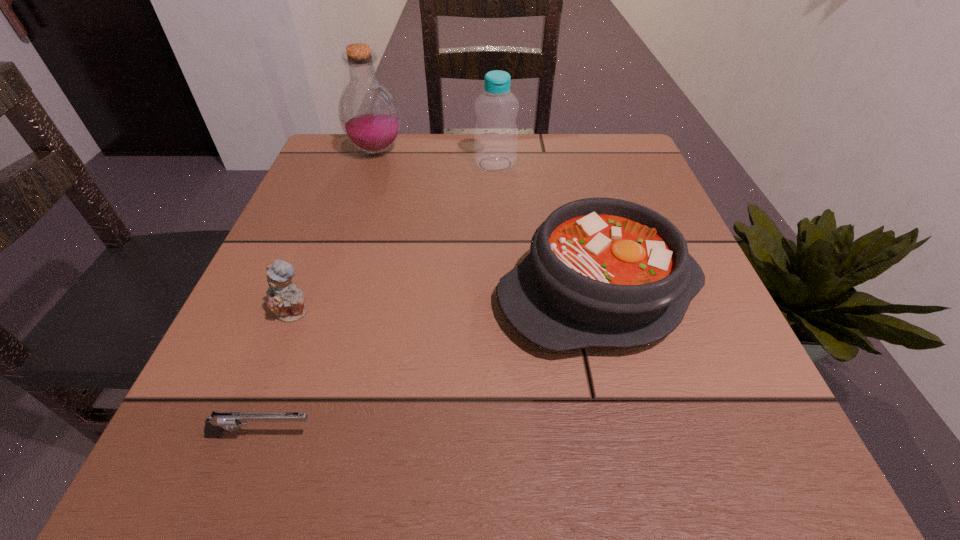
Locate an element on the screen. The height and width of the screenshot is (540, 960). free location at the left edge is located at coordinates [295, 367].

This screenshot has height=540, width=960. I want to click on free space at the right edge of the desktop, so click(x=706, y=391).

The height and width of the screenshot is (540, 960). Identify the location of blank space at the far left corner. (373, 187).

The width and height of the screenshot is (960, 540). In the image, there is a desktop. What are the coordinates of `vacant space at the near left corner` in the screenshot? It's located at (288, 488).

In order to click on vacant space at the far right corner of the desktop in this screenshot , I will do click(590, 187).

Find the location of a particular element. The height and width of the screenshot is (540, 960). vacant space in between the right bottle and the fourth tallest object is located at coordinates (396, 238).

Find the location of `empty space between the fourth tallest object and the casserole`. empty space between the fourth tallest object and the casserole is located at coordinates tap(446, 303).

At what (x,y) coordinates should I click in order to perform the action: click on blank region between the casserole and the nearest object. Please return your answer as a coordinate pair (x, y). Looking at the image, I should click on (430, 364).

This screenshot has height=540, width=960. I want to click on empty location between the right bottle and the second shortest object, so click(x=396, y=238).

I want to click on free space between the shortest object and the teddy bear, so click(278, 374).